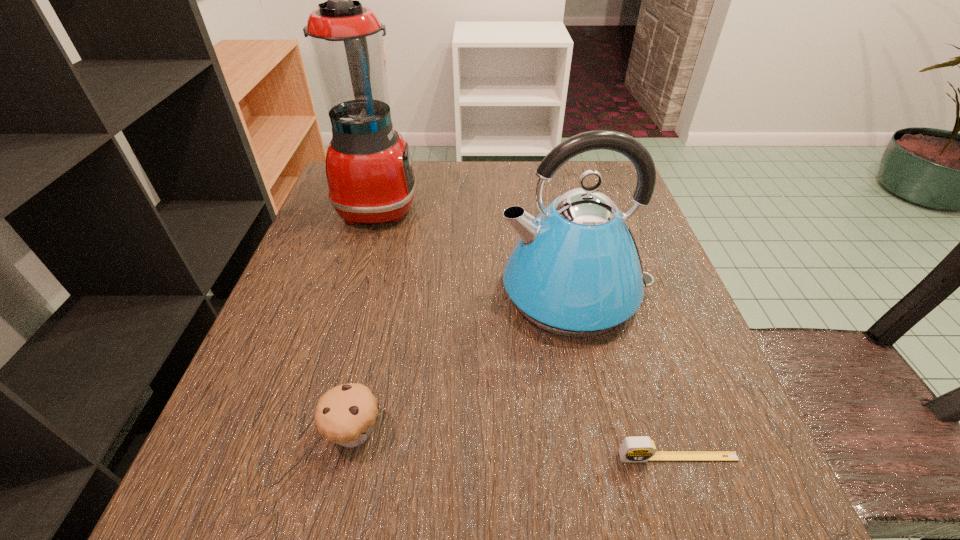
The height and width of the screenshot is (540, 960). What are the coordinates of `object at the near left corner` in the screenshot? It's located at (345, 414).

At what (x,y) coordinates should I click in order to perform the action: click on object at the near right corner. Please return your answer as a coordinate pair (x, y). The image size is (960, 540). Looking at the image, I should click on (640, 448).

Locate an element on the screen. The height and width of the screenshot is (540, 960). vacant space at the far edge is located at coordinates (476, 183).

In the image, there is a desktop. Where is `vacant space at the near edge`? vacant space at the near edge is located at coordinates (322, 516).

At what (x,y) coordinates should I click in order to perform the action: click on free location at the left edge of the desktop. Please return your answer as a coordinate pair (x, y). This screenshot has width=960, height=540. Looking at the image, I should click on (237, 399).

Find the location of a particular element. The height and width of the screenshot is (540, 960). vacant space at the right edge of the desktop is located at coordinates (713, 412).

The image size is (960, 540). In the image, there is a desktop. In order to click on vacant area at the near left corner in this screenshot , I will do `click(185, 524)`.

Find the location of a particular element. empty space that is in between the tallest object and the muffin is located at coordinates (366, 319).

The height and width of the screenshot is (540, 960). Identify the location of vacant area that lies between the tape measure and the kettle. [x=626, y=374].

Identify the location of vacant region between the tallest object and the second shortest object. The width and height of the screenshot is (960, 540). (366, 319).